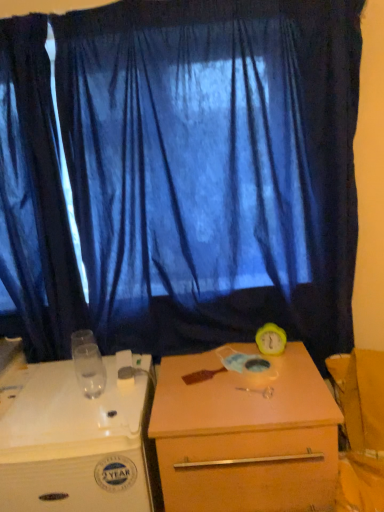
I want to click on blank space situated above white plastic desk at lower left, the second desk positioned from the right (from a real-world perspective), so (x=61, y=394).